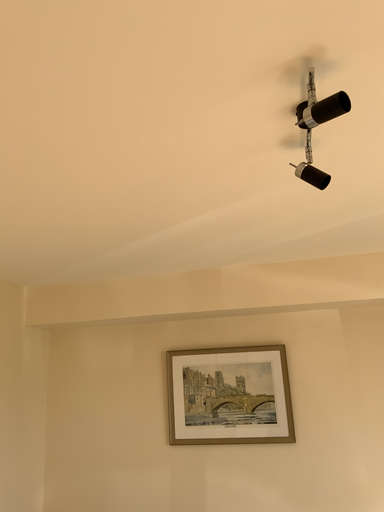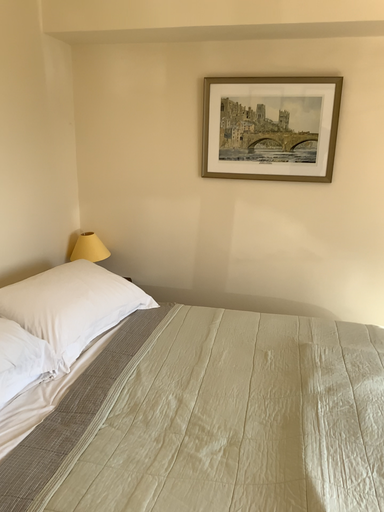
Question: How did the camera likely rotate when shooting the video?

Choices:
 (A) rotated downward
 (B) rotated upward

Answer: (A)